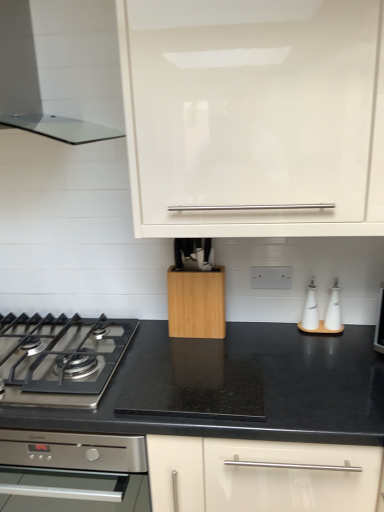
Question: Considering the relative sizes of beech wood knife block at center and transparent glass range hood at upper left in the image provided, is beech wood knife block at center bigger than transparent glass range hood at upper left?

Choices:
 (A) no
 (B) yes

Answer: (A)

Question: Can you confirm if beech wood knife block at center is wider than transparent glass range hood at upper left?

Choices:
 (A) yes
 (B) no

Answer: (B)

Question: From the image's perspective, is beech wood knife block at center above transparent glass range hood at upper left?

Choices:
 (A) no
 (B) yes

Answer: (A)

Question: From a real-world perspective, is beech wood knife block at center physically above transparent glass range hood at upper left?

Choices:
 (A) yes
 (B) no

Answer: (B)

Question: Considering the relative sizes of beech wood knife block at center and transparent glass range hood at upper left in the image provided, is beech wood knife block at center thinner than transparent glass range hood at upper left?

Choices:
 (A) no
 (B) yes

Answer: (B)

Question: Considering the positions of beech wood knife block at center and white glossy oil bottles at right in the image, is beech wood knife block at center wider or thinner than white glossy oil bottles at right?

Choices:
 (A) thin
 (B) wide

Answer: (B)

Question: From the image's perspective, relative to white glossy oil bottles at right, is beech wood knife block at center above or below?

Choices:
 (A) above
 (B) below

Answer: (A)

Question: Is beech wood knife block at center bigger or smaller than white glossy oil bottles at right?

Choices:
 (A) big
 (B) small

Answer: (A)

Question: From their relative heights in the image, would you say beech wood knife block at center is taller or shorter than white glossy oil bottles at right?

Choices:
 (A) tall
 (B) short

Answer: (A)

Question: Considering the relative positions of beech wood knife block at center and transparent glass range hood at upper left in the image provided, is beech wood knife block at center to the left or to the right of transparent glass range hood at upper left?

Choices:
 (A) left
 (B) right

Answer: (B)

Question: From the image's perspective, is beech wood knife block at center positioned above or below transparent glass range hood at upper left?

Choices:
 (A) below
 (B) above

Answer: (A)

Question: Looking at the image, does beech wood knife block at center seem bigger or smaller compared to transparent glass range hood at upper left?

Choices:
 (A) small
 (B) big

Answer: (A)

Question: Considering the positions of beech wood knife block at center and transparent glass range hood at upper left in the image, is beech wood knife block at center wider or thinner than transparent glass range hood at upper left?

Choices:
 (A) wide
 (B) thin

Answer: (B)

Question: Is stainless steel gas stove at lower left in front of or behind white glossy cabinet at upper center in the image?

Choices:
 (A) behind
 (B) front

Answer: (A)

Question: Choose the correct answer: Is stainless steel gas stove at lower left inside white glossy cabinet at upper center or outside it?

Choices:
 (A) outside
 (B) inside

Answer: (A)